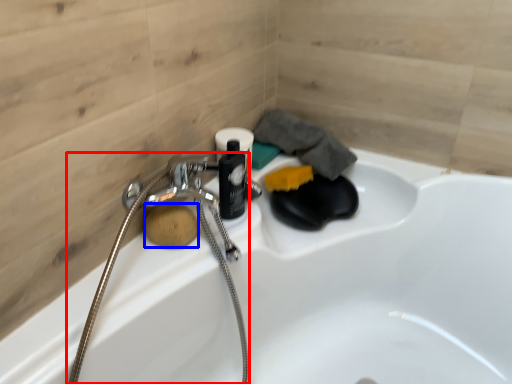
Question: Which object is further to the camera taking this photo, garden hose (highlighted by a red box) or soap (highlighted by a blue box)?

Choices:
 (A) garden hose
 (B) soap

Answer: (B)